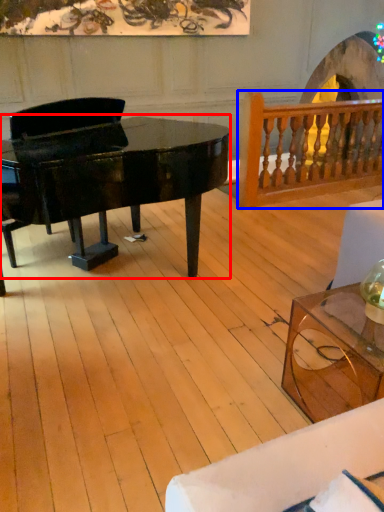
Question: Which object appears closest to the camera in this image, piano (highlighted by a red box) or rail (highlighted by a blue box)?

Choices:
 (A) piano
 (B) rail

Answer: (A)